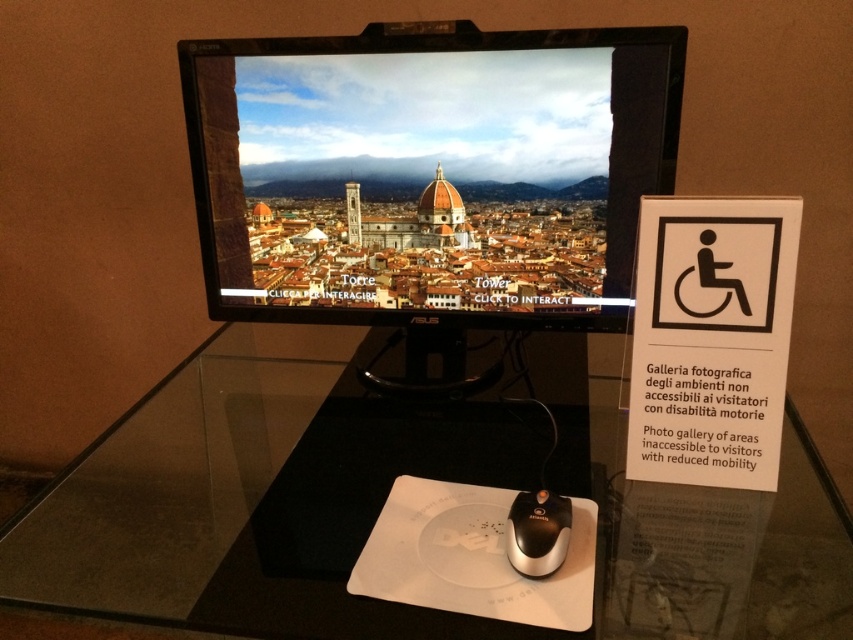
Does point (508, 260) come in front of point (692, 428)?

No.

Is point (434, 90) behind point (699, 380)?

Yes, it is.

Identify the location of black glossy monitor at center. (428, 172).

Who is more distant from viewer, (730, 493) or (431, 580)?

Point (730, 493)

Is transparent glass table at center to the left of white matte mouse pad at lower center from the viewer's perspective?

Indeed, transparent glass table at center is positioned on the left side of white matte mouse pad at lower center.

Does point (672, 612) come behind point (389, 536)?

No, (672, 612) is in front of (389, 536).

At what (x,y) coordinates should I click in order to perform the action: click on transparent glass table at center. Please return your answer as a coordinate pair (x, y). Image resolution: width=853 pixels, height=640 pixels. Looking at the image, I should click on (386, 497).

Is black glossy monitor at center positioned at the back of white matte mouse pad at lower center?

Yes, it is.

Who is taller, black glossy monitor at center or white matte mouse pad at lower center?

black glossy monitor at center is taller.

Image resolution: width=853 pixels, height=640 pixels. Identify the location of black glossy monitor at center. (428, 172).